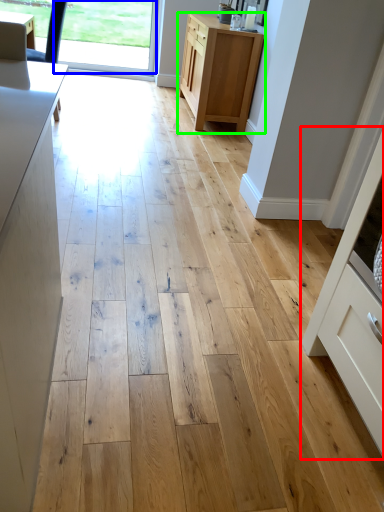
Question: Which object is positioned farthest from cabinetry (highlighted by a red box)? Select from window screen (highlighted by a blue box) and cabinetry (highlighted by a green box).

Choices:
 (A) window screen
 (B) cabinetry

Answer: (A)